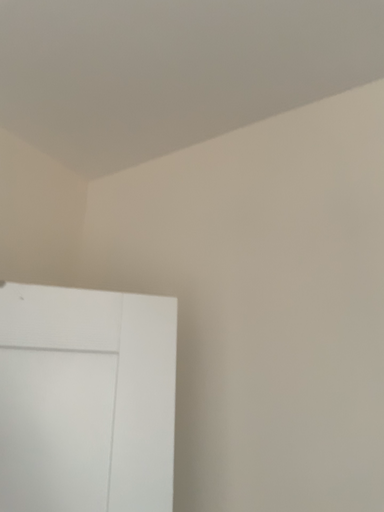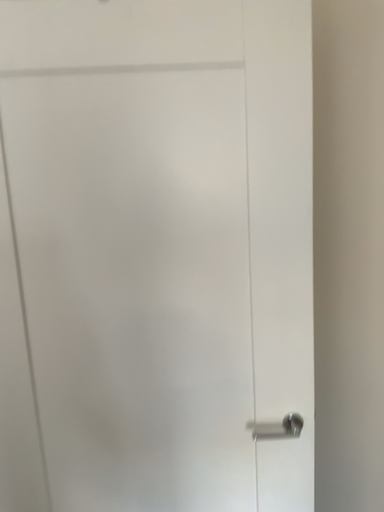
Question: Which way did the camera rotate in the video?

Choices:
 (A) rotated upward
 (B) rotated downward

Answer: (B)